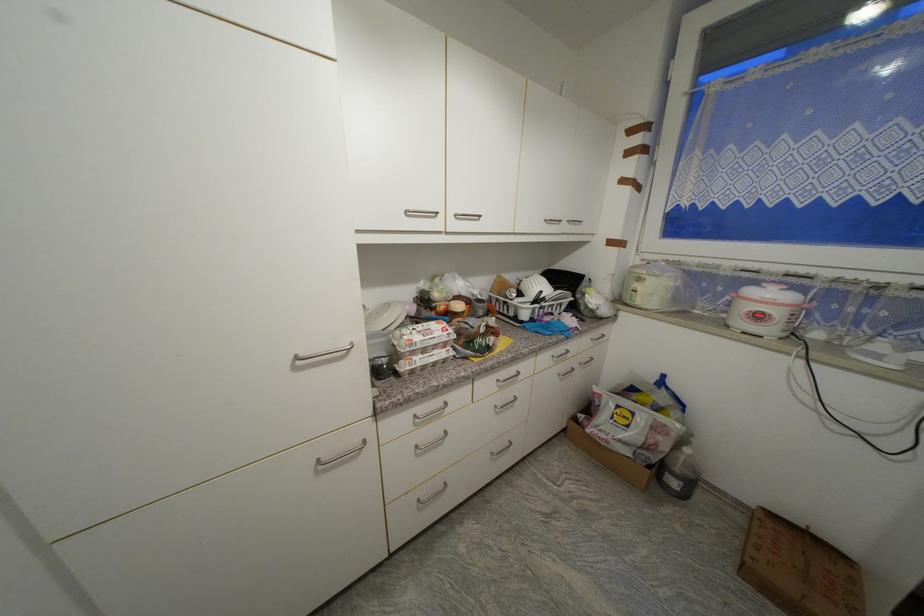
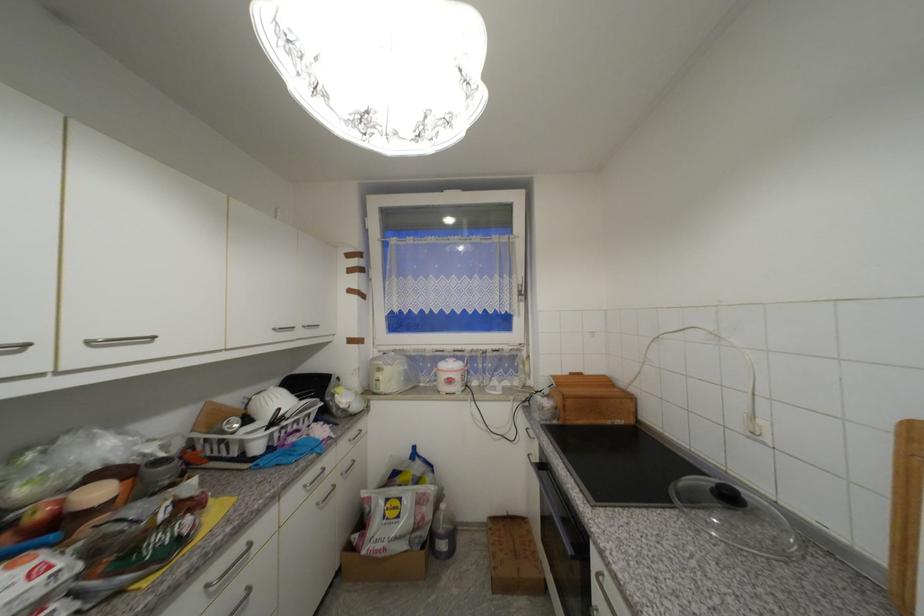
Locate, in the second image, the point that corresponds to (x=558, y=358) in the first image.

(310, 488)